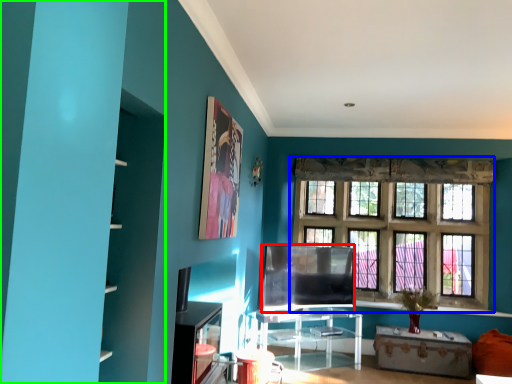
Question: Estimate the real-world distances between objects in this image. Which object is farther from window screen (highlighted by a red box), window (highlighted by a blue box) or bookshelf (highlighted by a green box)?

Choices:
 (A) window
 (B) bookshelf

Answer: (B)